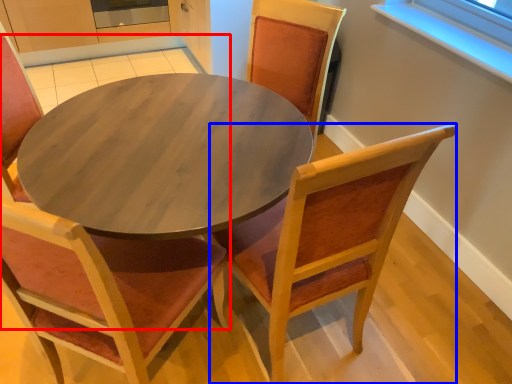
Question: Among these objects, which one is nearest to the camera, chair (highlighted by a red box) or chair (highlighted by a blue box)?

Choices:
 (A) chair
 (B) chair

Answer: (A)